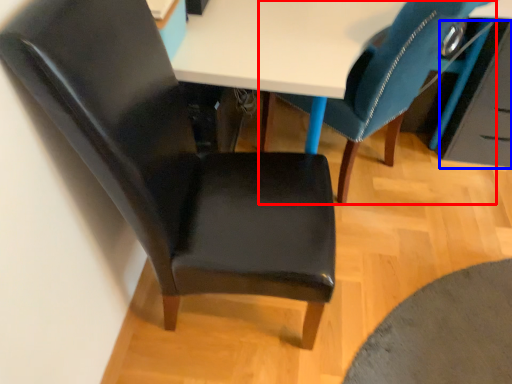
Question: Which of the following is the closest to the observer, chair (highlighted by a red box) or drawer (highlighted by a blue box)?

Choices:
 (A) chair
 (B) drawer

Answer: (A)